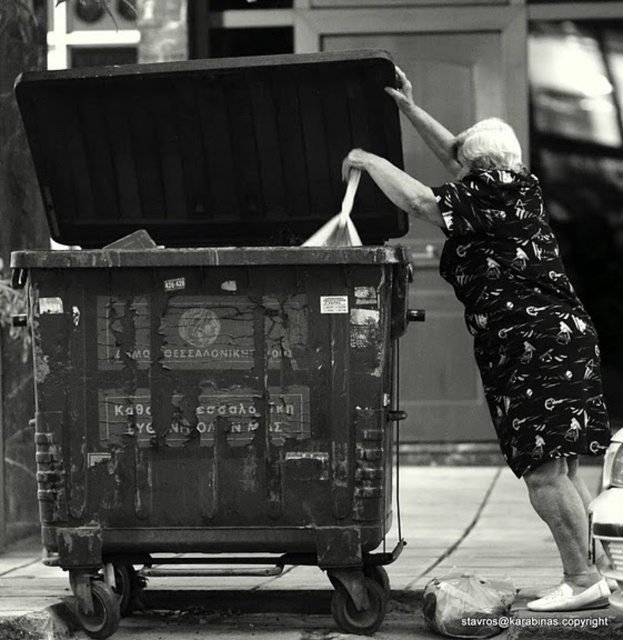
Question: Which object is farther from the camera taking this photo?

Choices:
 (A) plastic bag at lower right
 (B) rusty metal container at center

Answer: (A)

Question: Which object is positioned closest to the printed fabric dress at upper right?

Choices:
 (A) rusty metal container at center
 (B) plastic bag at lower right
 (C) black printed dress at right

Answer: (C)

Question: Which is farther from the rusty metal container at center?

Choices:
 (A) printed fabric dress at upper right
 (B) black printed dress at right
 (C) plastic bag at lower right

Answer: (B)

Question: Can you confirm if black printed dress at right is wider than plastic bag at lower right?

Choices:
 (A) no
 (B) yes

Answer: (B)

Question: Does rusty metal container at center come behind black printed dress at right?

Choices:
 (A) no
 (B) yes

Answer: (A)

Question: Is printed fabric dress at upper right bigger than black printed dress at right?

Choices:
 (A) yes
 (B) no

Answer: (A)